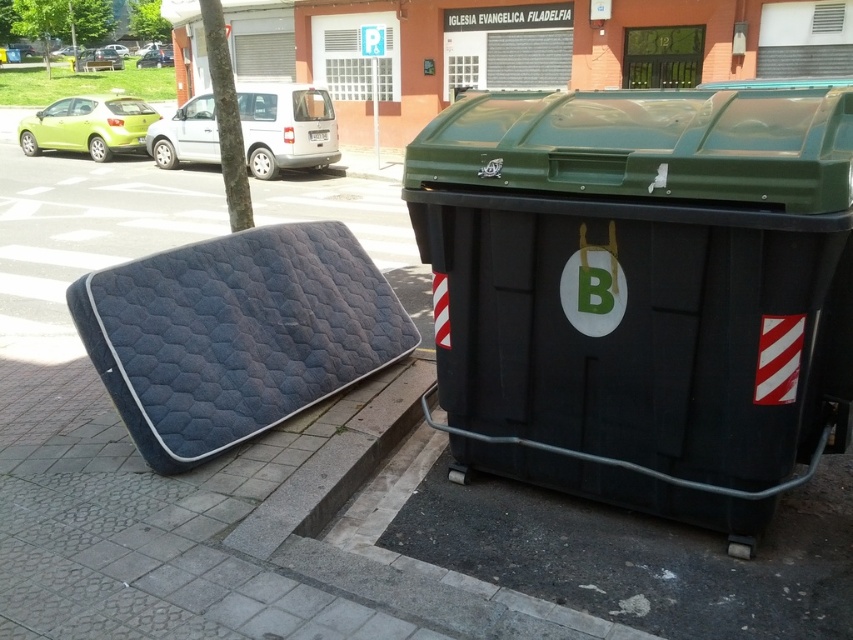
You are a delivery person trying to park your matte green car at upper left near the black plastic recycling bin at center. Can you park the car so that it doesn not block the recycling bin?

The black plastic recycling bin at center has a lesser height compared to matte green car at upper left. Since the recycling bin is shorter than the car, you can park the car without blocking the bin as the bin will remain visible below the car.

You are a delivery person standing at the curb. You need to place a package on the black plastic recycling bin at center. Is the bin within your reach?

The black plastic recycling bin at center is 2.02 meters from camera, so it is too far for the delivery person to reach without moving closer.

You are a delivery person trying to park your silver metallic van at center near the curb. There is a dark blue quilted mattress at lower left blocking the path. Can you safely maneuver around it to park?

The dark blue quilted mattress at lower left is closer to the viewer than the silver metallic van at center, so the mattress is in the way. You need to move it before parking.